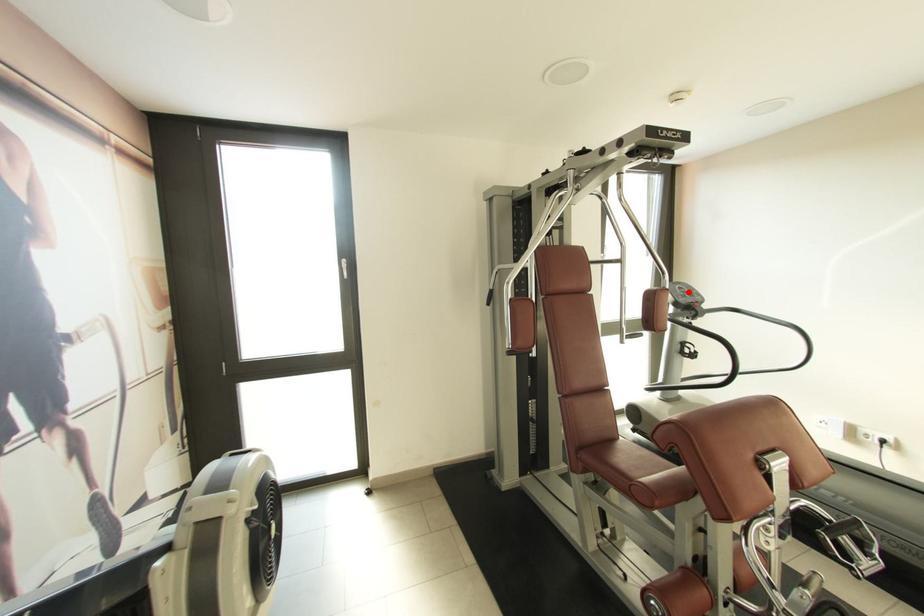
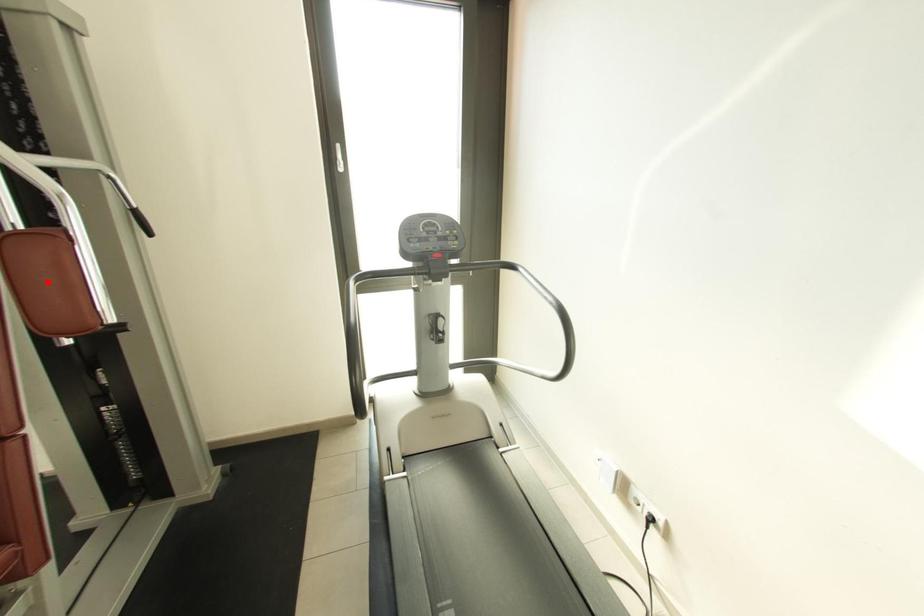
I am providing you with two images of the same scene from different viewpoints. A red point is marked on the first image and another point is marked on the second image. Does the point marked in image1 correspond to the same location as the one in image2?

No